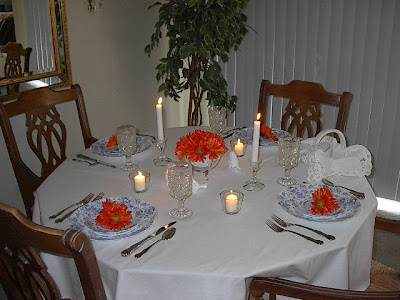
In order to click on crystal glasses in this screenshot , I will do pos(182,183), pos(129,151), pos(217,122), pos(292,156).